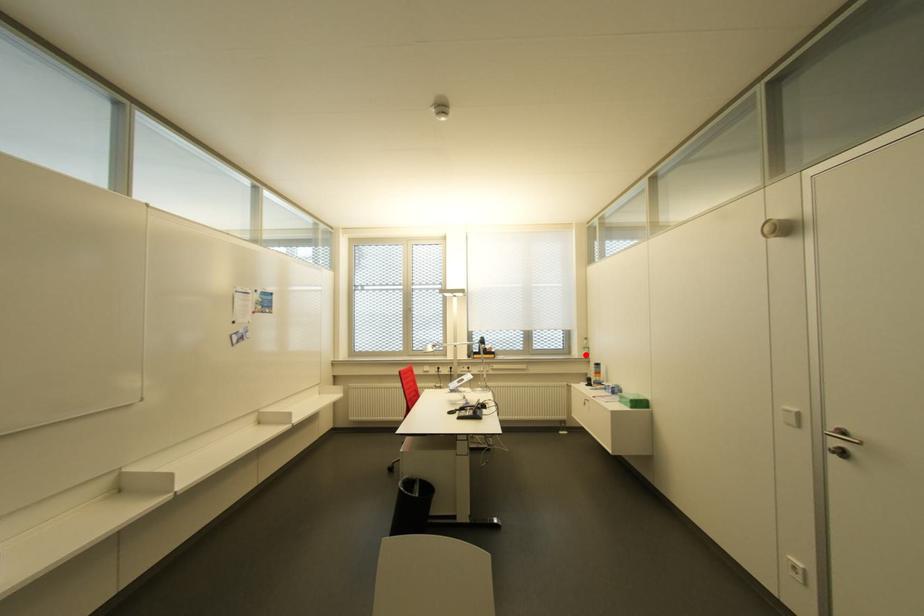
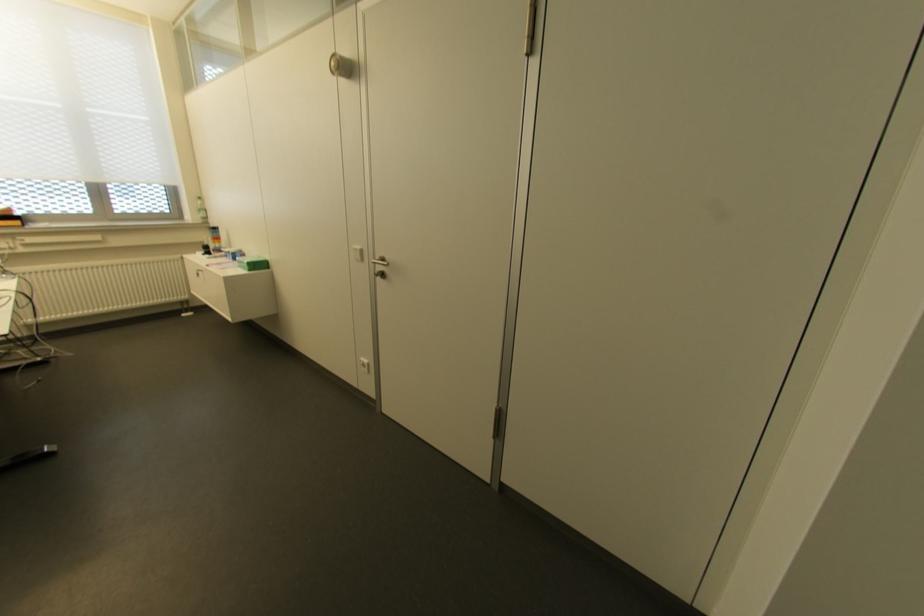
Question: A red point is marked in image1. In image2, is the corresponding 3D point closer to the camera or farther? Reply with the corresponding letter.

Choices:
 (A) The corresponding 3D point is closer.
 (B) The corresponding 3D point is farther.

Answer: (B)